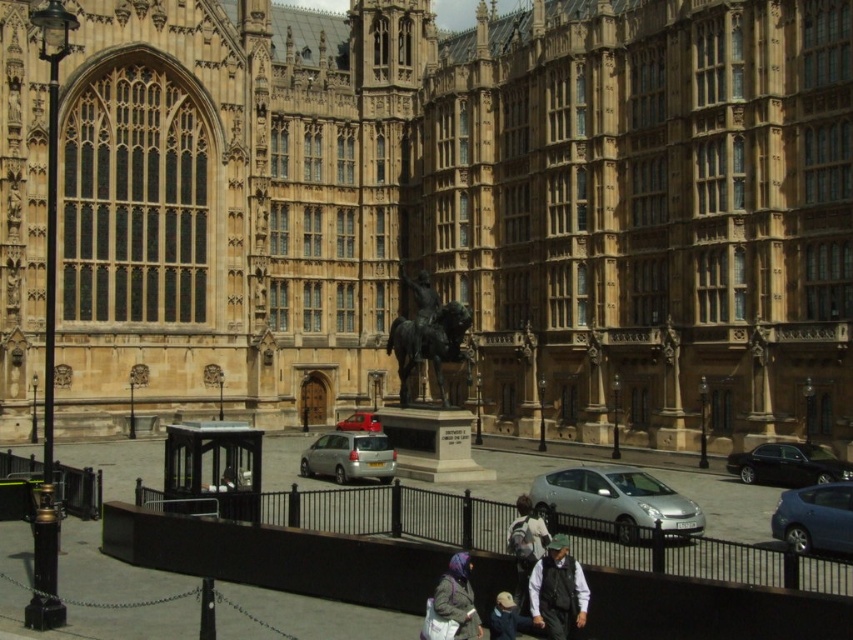
Question: Among these objects, which one is nearest to the camera?

Choices:
 (A) satin silver car at center
 (B) bronze statue at center

Answer: (A)

Question: Is bronze statue at center in front of metallic silver car at center?

Choices:
 (A) yes
 (B) no

Answer: (A)

Question: Which is nearer to the purple fabric headscarf at lower center?

Choices:
 (A) dark gray fabric jacket at lower center
 (B) brown stone statue at center
 (C) shiny black sedan at lower right

Answer: (A)

Question: Does satin silver car at center appear over light gray fabric jacket at center?

Choices:
 (A) no
 (B) yes

Answer: (B)

Question: Which object is the farthest from the shiny black sedan at lower right?

Choices:
 (A) brown stone statue at center
 (B) blue metallic hatchback at lower right
 (C) bronze statue at center

Answer: (A)

Question: Observing the image, what is the correct spatial positioning of silver metallic car at center in reference to shiny black sedan at lower right?

Choices:
 (A) below
 (B) above

Answer: (A)